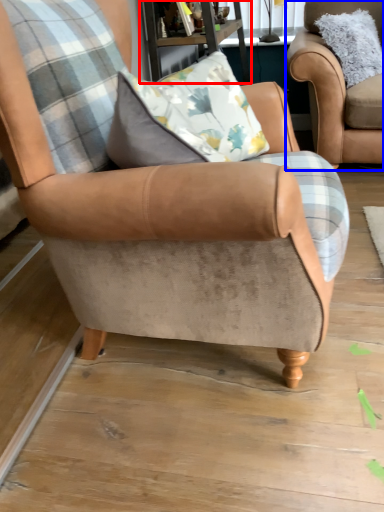
Question: Which object is closer to the camera taking this photo, table (highlighted by a red box) or chair (highlighted by a blue box)?

Choices:
 (A) table
 (B) chair

Answer: (A)